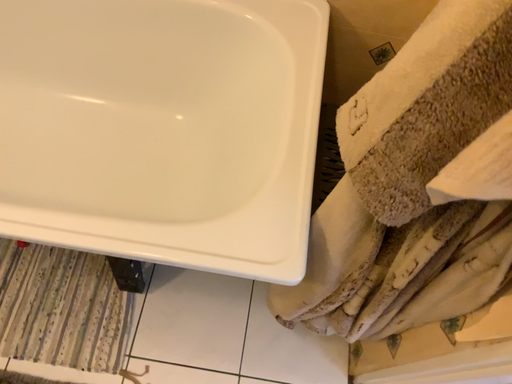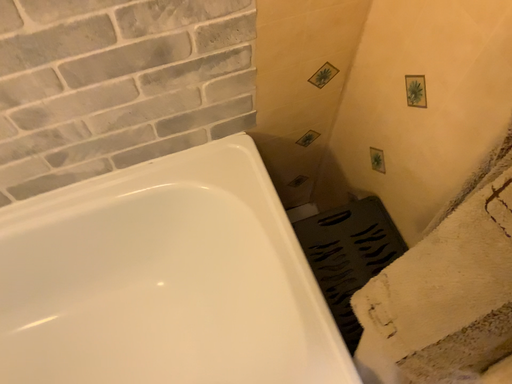
Question: How did the camera likely rotate when shooting the video?

Choices:
 (A) rotated right
 (B) rotated left

Answer: (A)